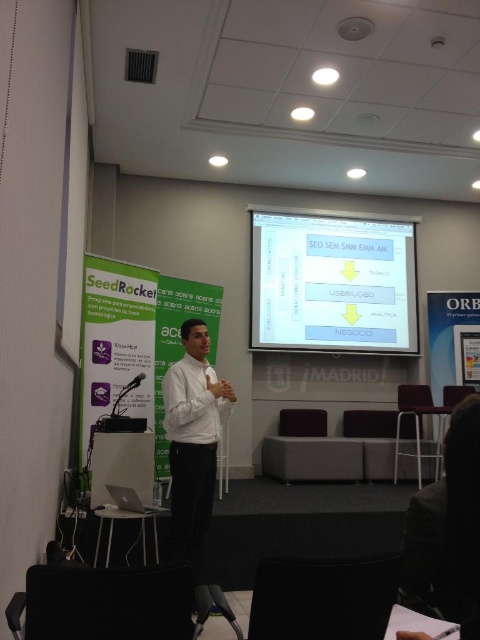
Can you confirm if white glossy projector screen at upper center is positioned to the right of dark brown hair at lower right?

Correct, you'll find white glossy projector screen at upper center to the right of dark brown hair at lower right.

Looking at this image, who is taller, white glossy projector screen at upper center or dark brown hair at lower right?

Standing taller between the two is white glossy projector screen at upper center.

Is point (362, 236) less distant than point (446, 452)?

No, (362, 236) is behind (446, 452).

You are a GUI agent. You are given a task and a screenshot of the screen. Output one action in this format:
    pyautogui.click(x=<x>, y=<y>)
    Task: Click on the white glossy projector screen at upper center
    This screenshot has width=480, height=640.
    Given the screenshot: What is the action you would take?
    pyautogui.click(x=333, y=282)

Image resolution: width=480 pixels, height=640 pixels. I want to click on dark brown hair at lower right, so click(451, 524).

Which is above, dark brown hair at lower right or white shirt at center?

Positioned higher is dark brown hair at lower right.

I want to click on dark brown hair at lower right, so click(x=451, y=524).

Where is `dark brown hair at lower right`? dark brown hair at lower right is located at coordinates (451, 524).

Does white glossy projector screen at upper center appear on the right side of white shirt at center?

Indeed, white glossy projector screen at upper center is positioned on the right side of white shirt at center.

What do you see at coordinates (333, 282) in the screenshot? The image size is (480, 640). I see `white glossy projector screen at upper center` at bounding box center [333, 282].

Locate an element on the screen. Image resolution: width=480 pixels, height=640 pixels. white glossy projector screen at upper center is located at coordinates (333, 282).